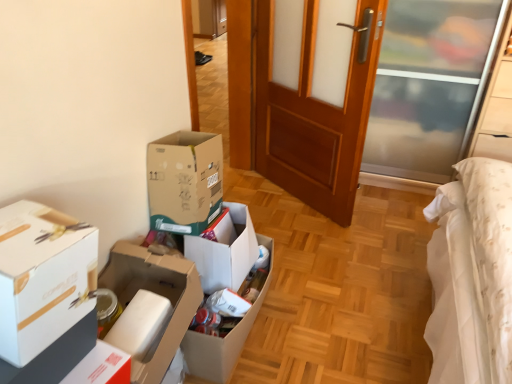
I want to click on free location to the right of cardboard box at center, positioned as the third box in front-to-back order, so click(x=322, y=317).